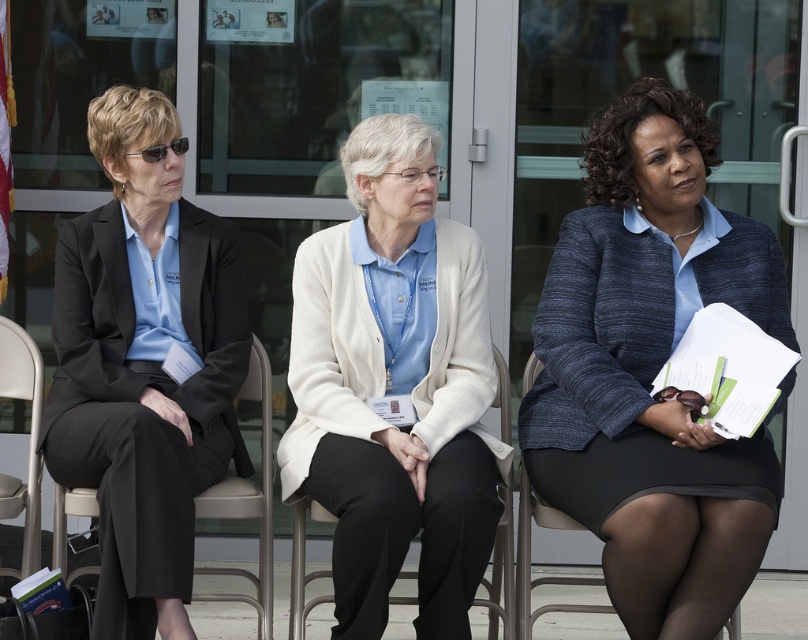
You are a photographer at the event and need to position a light to the right of the blue textured blazer at center. Will the light block the view of the black fabric chair at center from the camera?

The blue textured blazer at center is to the right of the black fabric chair at center, so placing the light to the right of the blazer would position it further away from the chair, meaning it won not block the view of the black fabric chair at center.

You are a photographer at this event and need to ensure that both the blue textured blazer at center and the light beige cardigan at center are visible in your photo. Based on their positions, which one is on the right side?

The blue textured blazer at center is positioned on the right side of the light beige cardigan at center, so the blue textured blazer at center is on the right.

You are an event organizer who needs to ensure that all attendees have enough space between their chairs. You notice the blue textured blazer at center and the black fabric chair at center. Which object is wider, requiring more space in the seating arrangement?

The blue textured blazer at center is wider than the black fabric chair at center, so it requires more space in the seating arrangement.